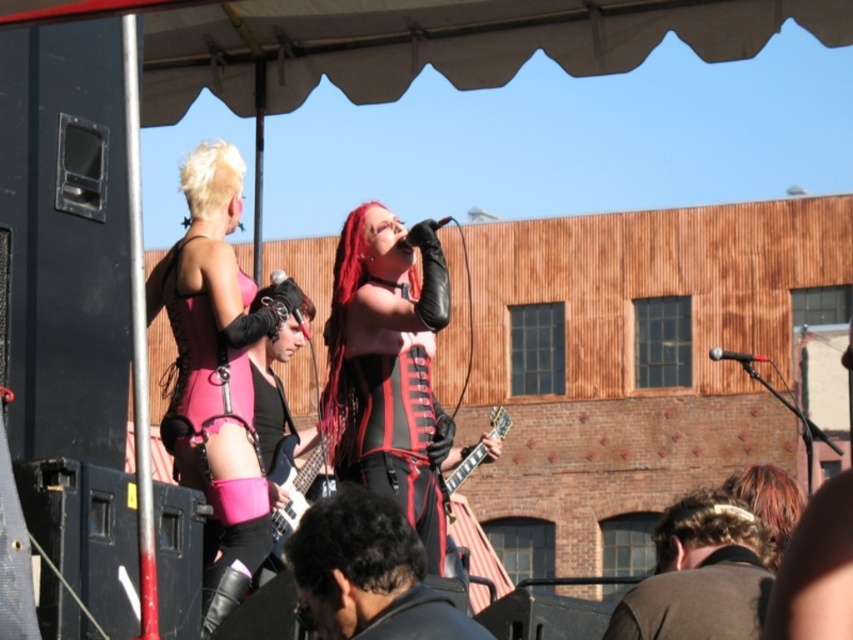
Question: Which object is closer to the camera taking this photo?

Choices:
 (A) shiny black guitar at center
 (B) black leather jacket at lower center

Answer: (B)

Question: Can you confirm if black leather jacket at lower center is positioned to the left of shiny black guitar at center?

Choices:
 (A) no
 (B) yes

Answer: (B)

Question: Is pink matte corset at upper left thinner than brown fur hat at center?

Choices:
 (A) no
 (B) yes

Answer: (B)

Question: Which of the following is the closest to the observer?

Choices:
 (A) black leather jacket at lower center
 (B) pink matte corset at upper left

Answer: (A)

Question: Does pink matte corset at upper left have a lesser width compared to brown fur hat at center?

Choices:
 (A) no
 (B) yes

Answer: (B)

Question: Which point is closer to the camera?

Choices:
 (A) (444, 481)
 (B) (238, 490)
 (C) (669, 614)
 (D) (434, 630)

Answer: (D)